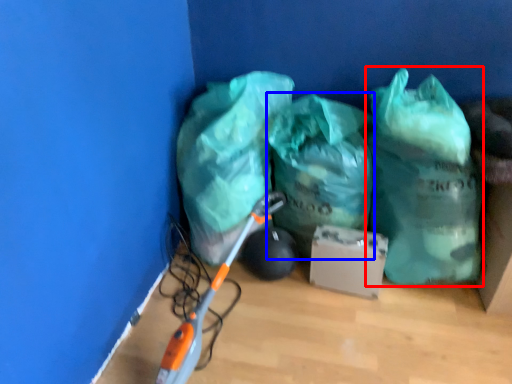
Question: Which point is closer to the camera, plastic bag (highlighted by a red box) or plastic bag (highlighted by a blue box)?

Choices:
 (A) plastic bag
 (B) plastic bag

Answer: (A)